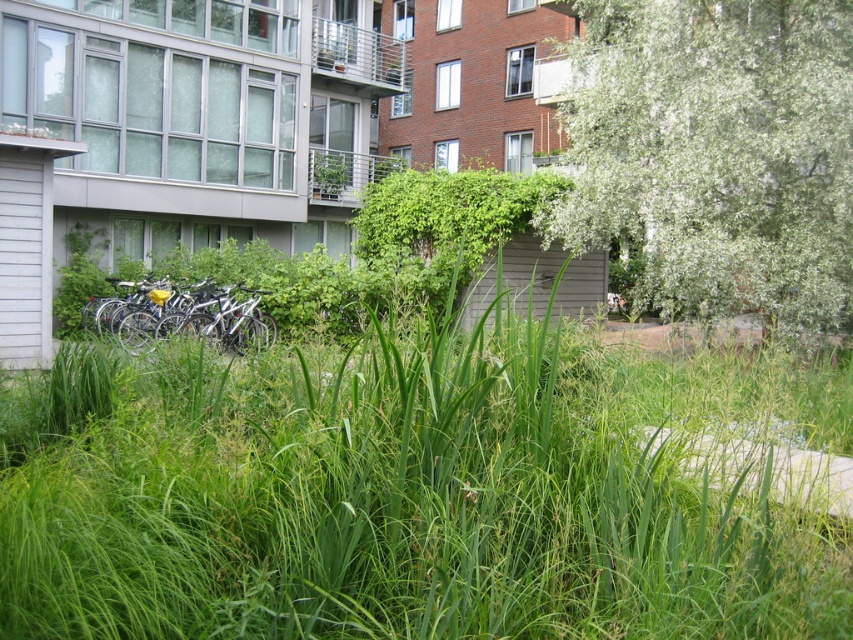
Does white fluffy tree at upper right appear over silver metallic bicycle at left?

Yes, white fluffy tree at upper right is above silver metallic bicycle at left.

Does white fluffy tree at upper right lie in front of silver metallic bicycle at left?

Yes.

The width and height of the screenshot is (853, 640). Identify the location of white fluffy tree at upper right. (718, 152).

You are a GUI agent. You are given a task and a screenshot of the screen. Output one action in this format:
    pyautogui.click(x=<x>, y=<y>)
    Task: Click on the white fluffy tree at upper right
    Image resolution: width=853 pixels, height=640 pixels.
    Given the screenshot: What is the action you would take?
    pyautogui.click(x=718, y=152)

Is green leafy grass at center shorter than silver metallic bicycle at left?

Indeed, green leafy grass at center has a lesser height compared to silver metallic bicycle at left.

The image size is (853, 640). I want to click on green leafy grass at center, so click(x=409, y=493).

Locate an element on the screen. The height and width of the screenshot is (640, 853). green leafy grass at center is located at coordinates click(x=409, y=493).

Who is lower down, green leafy grass at center or white fluffy tree at upper right?

Positioned lower is green leafy grass at center.

Between point (274, 612) and point (639, 58), which one is positioned in front?

Point (274, 612) is in front.

This screenshot has height=640, width=853. I want to click on green leafy grass at center, so click(409, 493).